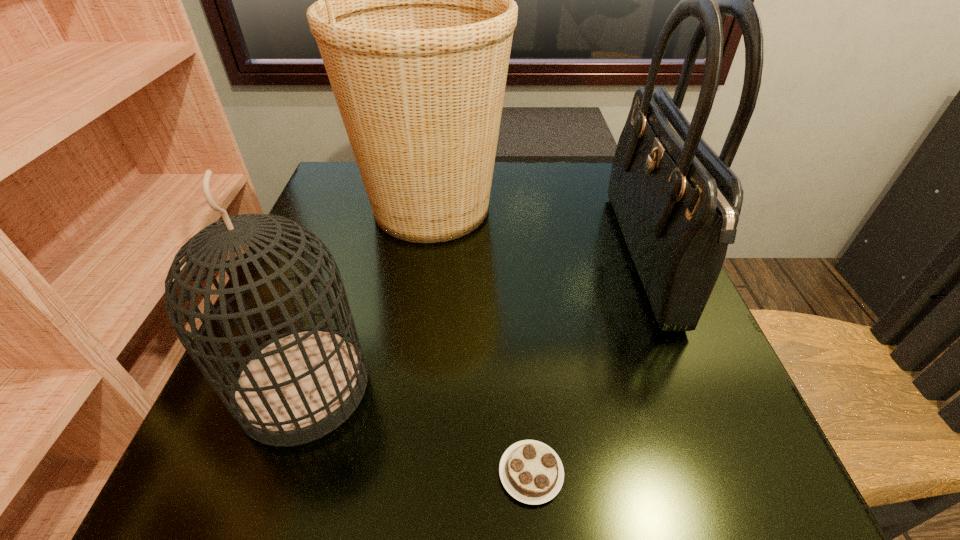
You are a GUI agent. You are given a task and a screenshot of the screen. Output one action in this format:
    pyautogui.click(x=<x>, y=<y>)
    Task: Click on the basket located at the far edge
    The height and width of the screenshot is (540, 960).
    Given the screenshot: What is the action you would take?
    pyautogui.click(x=414, y=22)

Where is `handbag that is at the far edge`? handbag that is at the far edge is located at coordinates (677, 202).

Identify the location of birdcage located in the near edge section of the desktop. (297, 387).

This screenshot has width=960, height=540. Identify the location of chocolate cake that is at the near edge. (531, 472).

This screenshot has height=540, width=960. I want to click on basket that is at the left edge, so click(414, 22).

Where is `birdcage at the left edge`? This screenshot has width=960, height=540. birdcage at the left edge is located at coordinates (297, 387).

At what (x,y) coordinates should I click in order to perform the action: click on object that is at the right edge. Please return your answer as a coordinate pair (x, y). Looking at the image, I should click on (677, 202).

Locate an element on the screen. This screenshot has height=540, width=960. object at the far left corner is located at coordinates (414, 22).

This screenshot has height=540, width=960. What are the coordinates of `object that is positioned at the near left corner` in the screenshot? It's located at (297, 387).

I want to click on object that is at the far right corner, so click(677, 202).